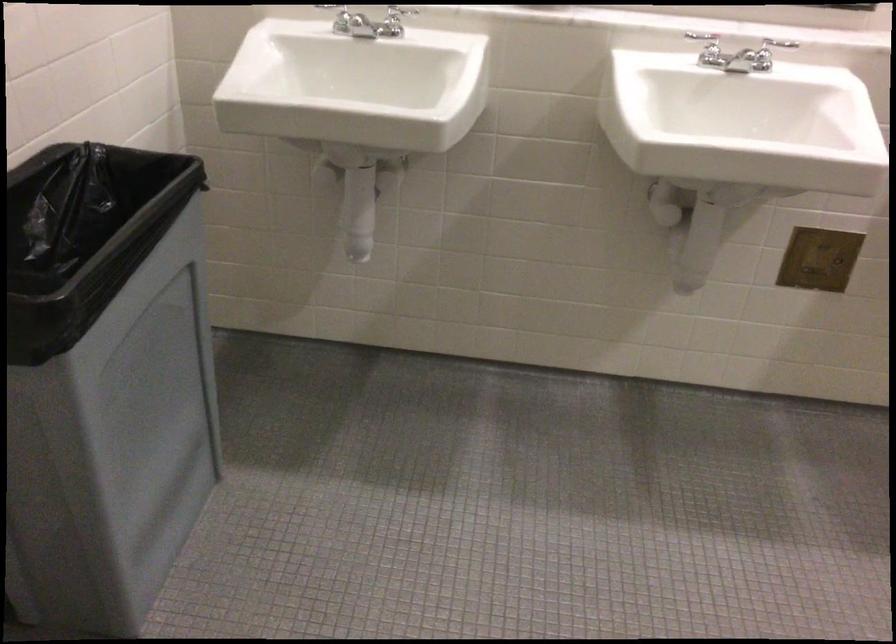
Based on the continuous images, in which direction is the camera rotating?

The camera's rotation is toward right-down.